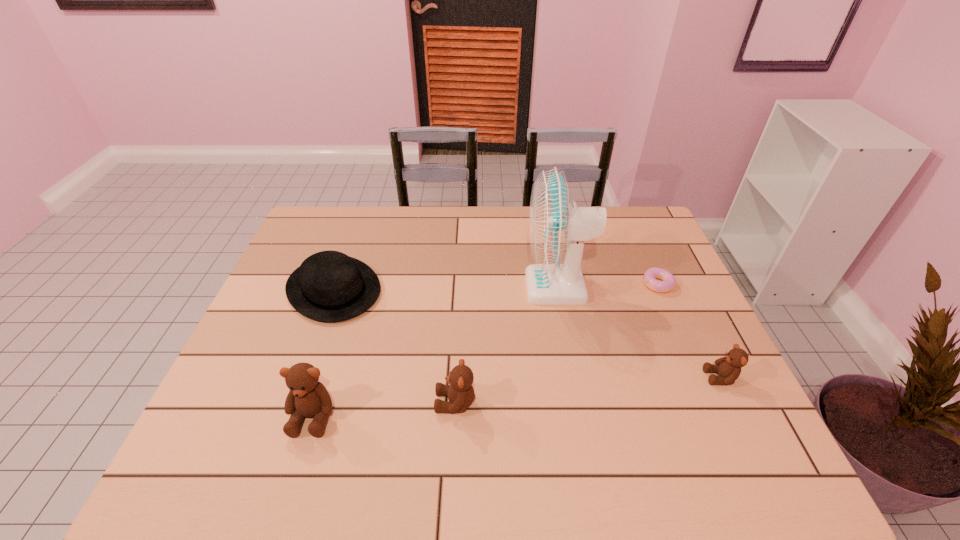
You are a GUI agent. You are given a task and a screenshot of the screen. Output one action in this format:
    pyautogui.click(x=<x>, y=<y>)
    Task: Click on the object present at the left edge
    The height and width of the screenshot is (540, 960).
    Given the screenshot: What is the action you would take?
    329,286

The height and width of the screenshot is (540, 960). What are the coordinates of `teddy bear at the right edge` in the screenshot? It's located at (728, 368).

Identify the location of doughnut located in the right edge section of the desktop. (650, 277).

Where is `vacant area at the far edge`? The height and width of the screenshot is (540, 960). vacant area at the far edge is located at coordinates (460, 226).

This screenshot has width=960, height=540. I want to click on vacant region at the near edge of the desktop, so click(x=398, y=401).

The image size is (960, 540). What are the coordinates of `vacant area at the left edge` in the screenshot? It's located at (278, 367).

In the image, there is a desktop. Where is `vacant space at the right edge`? vacant space at the right edge is located at coordinates (650, 251).

I want to click on vacant position at the far left corner of the desktop, so click(313, 241).

This screenshot has width=960, height=540. Find the location of `free spot between the tallest teddy bear and the fourth object from right to left`. free spot between the tallest teddy bear and the fourth object from right to left is located at coordinates (384, 409).

Find the location of a particular element. This screenshot has width=960, height=540. free space between the rightmost teddy bear and the fan is located at coordinates (638, 332).